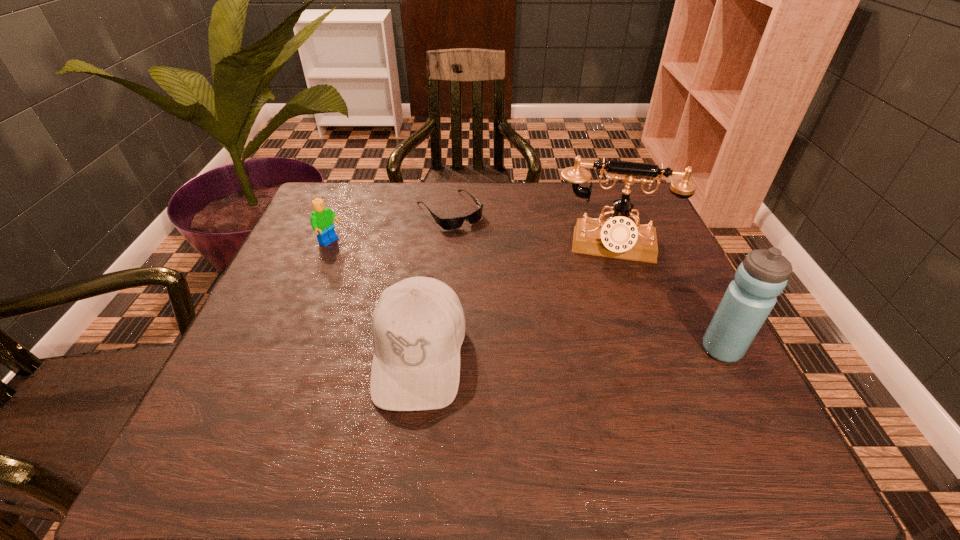
I want to click on baseball cap, so [x=418, y=326].

Locate an element on the screen. The image size is (960, 540). water bottle is located at coordinates (762, 276).

Where is `telephone`? This screenshot has width=960, height=540. telephone is located at coordinates (619, 237).

Image resolution: width=960 pixels, height=540 pixels. What are the coordinates of `Lego` in the screenshot? It's located at (322, 218).

Locate an element on the screen. the shortest object is located at coordinates (455, 223).

At what (x,y) coordinates should I click in order to perform the action: click on free space located on the front of the water bottle. Please return your answer as a coordinate pair (x, y). The image size is (960, 540). Looking at the image, I should click on (747, 398).

Find the location of a particular element. The image size is (960, 540). free spot located 0.110m on the dial of the telephone is located at coordinates (605, 296).

Locate an element on the screen. free space located on the dial of the telephone is located at coordinates (603, 371).

I want to click on blank space located on the dial of the telephone, so click(604, 349).

Identify the location of vacant point located on the face of the leftmost object. (447, 301).